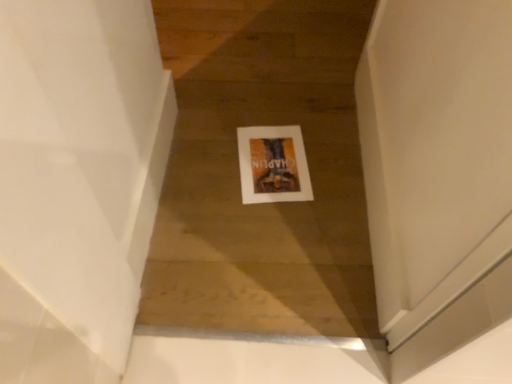
You are a GUI agent. You are given a task and a screenshot of the screen. Output one action in this format:
    pyautogui.click(x=<x>, y=<y>)
    Task: Click on the vacant space underneath white matte picture frame at center (from a real-world perspective)
    
    Given the screenshot: What is the action you would take?
    pyautogui.click(x=269, y=161)